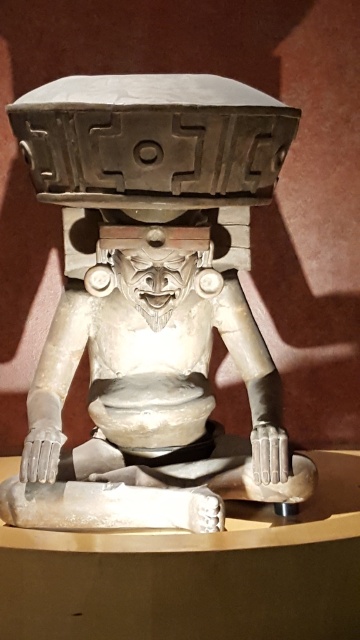
Question: Which of the following is the closest to the observer?

Choices:
 (A) (115, 269)
 (B) (191, 397)

Answer: (A)

Question: Which object is closer to the camera taking this photo?

Choices:
 (A) white stone carving at center
 (B) white matte sculpture at center

Answer: (B)

Question: Is white matte sculpture at center smaller than white stone carving at center?

Choices:
 (A) yes
 (B) no

Answer: (B)

Question: Which of the following is the farthest from the observer?

Choices:
 (A) white matte sculpture at center
 (B) white stone carving at center

Answer: (B)

Question: From the image, what is the correct spatial relationship of white matte sculpture at center in relation to white stone carving at center?

Choices:
 (A) above
 (B) below

Answer: (B)

Question: Does white matte sculpture at center appear on the left side of white stone carving at center?

Choices:
 (A) yes
 (B) no

Answer: (B)